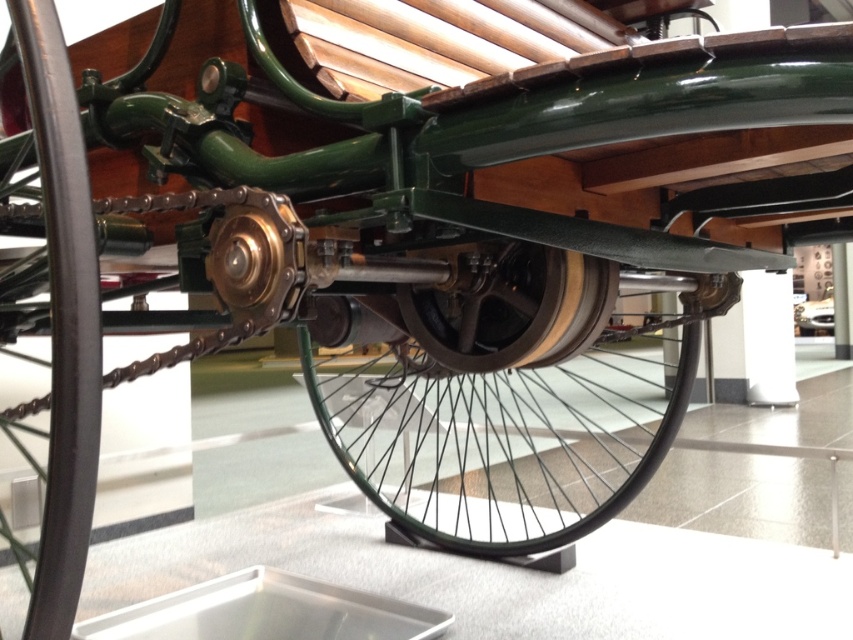
Question: Considering the relative positions of black rubber tire at lower left and shiny black tire at center in the image provided, where is black rubber tire at lower left located with respect to shiny black tire at center?

Choices:
 (A) below
 (B) above

Answer: (A)

Question: Which of the following is the closest to the observer?

Choices:
 (A) (582, 330)
 (B) (434, 492)

Answer: (A)

Question: Considering the relative positions of black rubber tire at lower left and shiny black tire at center in the image provided, where is black rubber tire at lower left located with respect to shiny black tire at center?

Choices:
 (A) below
 (B) above

Answer: (A)

Question: Does black rubber tire at lower left have a lesser width compared to shiny black tire at center?

Choices:
 (A) no
 (B) yes

Answer: (B)

Question: Which is nearer to the shiny black tire at center?

Choices:
 (A) black rubber tire at lower left
 (B) green wire-spoke wheel at center

Answer: (A)

Question: Considering the real-world distances, which object is closest to the shiny black tire at center?

Choices:
 (A) black rubber tire at lower left
 (B) green wire-spoke wheel at center

Answer: (A)